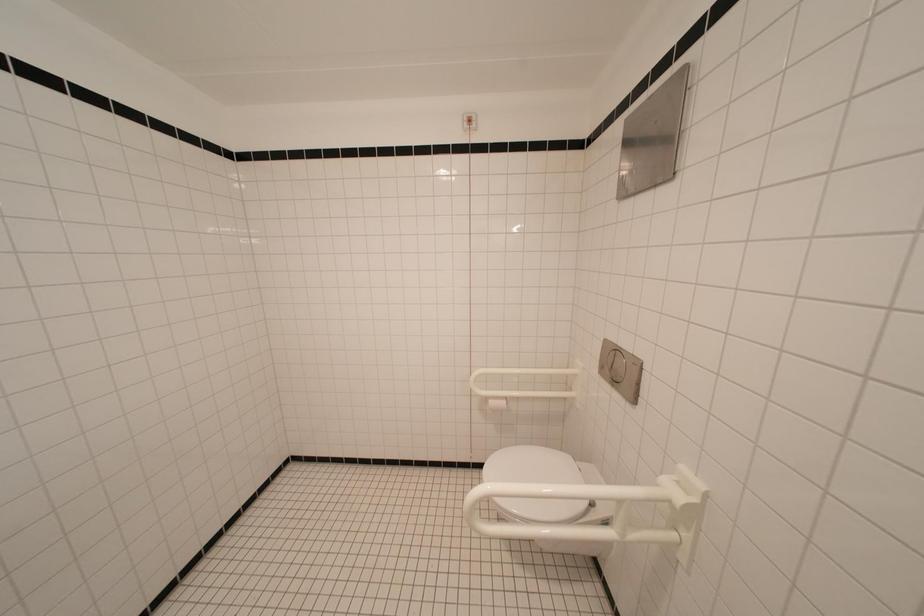
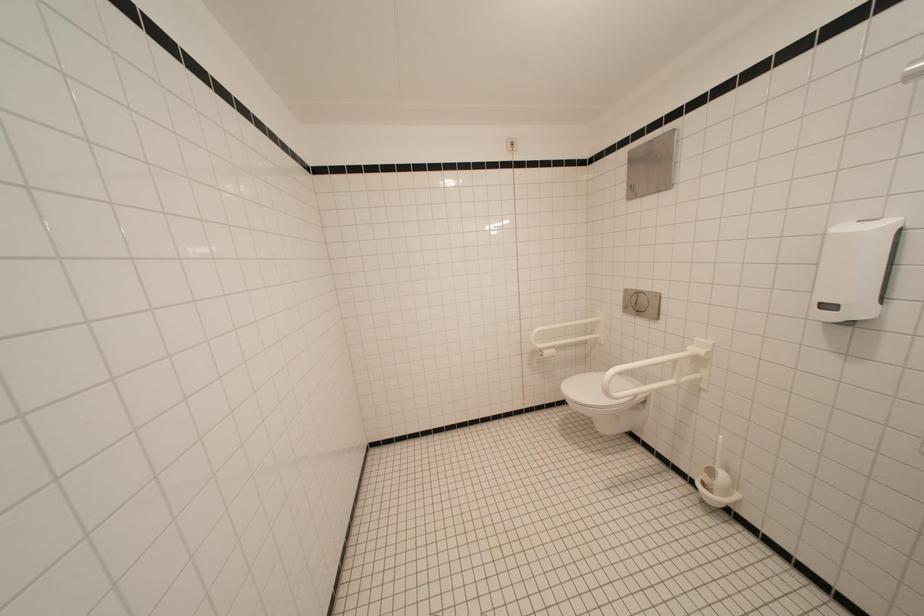
Question: Based on the continuous images, in which direction is the camera rotating? Reply with the corresponding letter.

Choices:
 (A) Left
 (B) Right
 (C) Up
 (D) Down

Answer: (B)